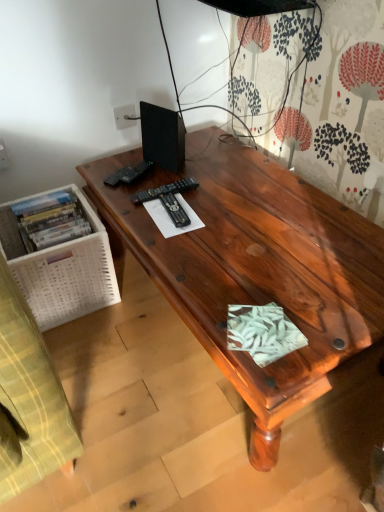
You are a GUI agent. You are given a task and a screenshot of the screen. Output one action in this format:
    pyautogui.click(x=<x>, y=<y>)
    Task: Click on the vacant region to the left of black plastic remote control at upper left, the first remote control in the back-to-front sequence
    
    Given the screenshot: What is the action you would take?
    pyautogui.click(x=105, y=174)